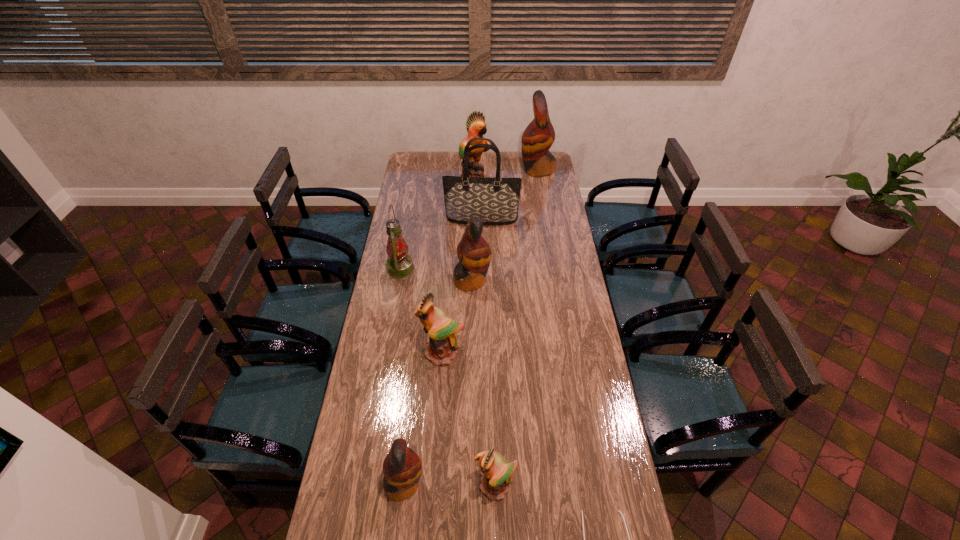
I want to click on green parrot that stands as the closest to the third farthest object, so click(x=476, y=126).

Identify which red parrot is the third closest to the tote bag. Please provide its 2D coordinates. Your answer should be formatted as a tuple, i.e. [(x, y)], where the tuple contains the x and y coordinates of a point satisfying the conditions above.

[(402, 467)]

This screenshot has width=960, height=540. I want to click on the second closest red parrot to the farthest red parrot, so (x=402, y=467).

Locate an element on the screen. The height and width of the screenshot is (540, 960). vacant space that satisfies the following two spatial constraints: 1. on the face of the biggest red parrot; 2. on the front-facing side of the nearest green parrot is located at coordinates (588, 486).

Locate an element on the screen. vacant area in the image that satisfies the following two spatial constraints: 1. on the front-facing side of the farthest green parrot; 2. on the left side of the black tote bag is located at coordinates (473, 219).

Locate an element on the screen. The width and height of the screenshot is (960, 540). blank space that satisfies the following two spatial constraints: 1. on the face of the biggest red parrot; 2. on the front-facing side of the second farthest green parrot is located at coordinates (567, 354).